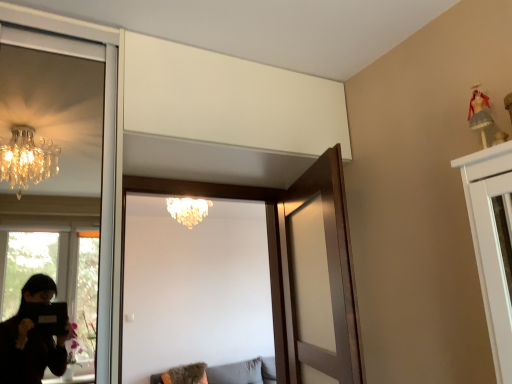
The height and width of the screenshot is (384, 512). I want to click on wooden door at center, placed as the 1th door when sorted from left to right, so click(x=275, y=219).

At what (x,y) coordinates should I click in order to perform the action: click on wooden door at center, which ranks as the 2th door in left-to-right order. Please return your answer as a coordinate pair (x, y). Looking at the image, I should click on (317, 276).

At what (x,y) coordinates should I click in order to perform the action: click on fluffy beige pillow at lower center. Please return your answer as a coordinate pair (x, y). The height and width of the screenshot is (384, 512). Looking at the image, I should click on (186, 374).

Can you tell me how much wooden door at center, acting as the 1th door starting from the right, and crystal chandelier at upper center differ in facing direction?

There is a 108-degree angle between the facing directions of wooden door at center, acting as the 1th door starting from the right, and crystal chandelier at upper center.

Which object is positioned more to the right, wooden door at center, which ranks as the 2th door in left-to-right order, or crystal chandelier at upper center?

From the viewer's perspective, wooden door at center, which ranks as the 2th door in left-to-right order, appears more on the right side.

Considering the relative sizes of wooden door at center, acting as the 1th door starting from the right, and crystal chandelier at upper center in the image provided, is wooden door at center, acting as the 1th door starting from the right, bigger than crystal chandelier at upper center?

No, wooden door at center, acting as the 1th door starting from the right, is not bigger than crystal chandelier at upper center.

From the image's perspective, does wooden door at center, acting as the 1th door starting from the right, appear higher than crystal chandelier at upper center?

No, from the image's perspective, wooden door at center, acting as the 1th door starting from the right, is not over crystal chandelier at upper center.

Does wooden door at center, acting as the 2th door starting from the right, have a lesser width compared to wooden door at center, which ranks as the 2th door in left-to-right order?

Incorrect, the width of wooden door at center, acting as the 2th door starting from the right, is not less than that of wooden door at center, which ranks as the 2th door in left-to-right order.

Considering the relative sizes of wooden door at center, acting as the 2th door starting from the right, and wooden door at center, which ranks as the 2th door in left-to-right order, in the image provided, is wooden door at center, acting as the 2th door starting from the right, smaller than wooden door at center, which ranks as the 2th door in left-to-right order,?

No.

Is wooden door at center, acting as the 2th door starting from the right, positioned before wooden door at center, acting as the 1th door starting from the right?

No, it is behind wooden door at center, acting as the 1th door starting from the right.

The height and width of the screenshot is (384, 512). In the image, there is a wooden door at center, acting as the 2th door starting from the right. Identify the location of door below it (from a real-world perspective). (317, 276).

Is gray fabric couch at lower center in front of or behind fluffy beige pillow at lower center in the image?

gray fabric couch at lower center is in front of fluffy beige pillow at lower center.

Between gray fabric couch at lower center and fluffy beige pillow at lower center, which one appears on the left side from the viewer's perspective?

fluffy beige pillow at lower center is more to the left.

In terms of size, does gray fabric couch at lower center appear bigger or smaller than fluffy beige pillow at lower center?

Considering their sizes, gray fabric couch at lower center takes up more space than fluffy beige pillow at lower center.

From a real-world perspective, which object stands above the other?

crystal chandelier at upper center, from a real-world perspective.

From the image's perspective, is fluffy beige pillow at lower center beneath crystal chandelier at upper center?

Yes, from the image's perspective, fluffy beige pillow at lower center is below crystal chandelier at upper center.

Is fluffy beige pillow at lower center oriented towards crystal chandelier at upper center?

No.

Which object is positioned more to the right, crystal chandelier at upper center or wooden door at center, placed as the 1th door when sorted from left to right?

wooden door at center, placed as the 1th door when sorted from left to right.

Between crystal chandelier at upper center and wooden door at center, placed as the 1th door when sorted from left to right, which one has smaller size?

crystal chandelier at upper center.

Between crystal chandelier at upper center and wooden door at center, placed as the 1th door when sorted from left to right, which one has larger width?

crystal chandelier at upper center.

Find the location of a particular element. Image resolution: width=512 pixels, height=384 pixels. door that is the 1st one below the crystal chandelier at upper center (from a real-world perspective) is located at coordinates (275, 219).

In order to click on the 1st door to the right of the gray fabric couch at lower center, counting from the anchor's position in this screenshot , I will do `click(275, 219)`.

Are wooden door at center, acting as the 2th door starting from the right, and gray fabric couch at lower center located far from each other?

Indeed, wooden door at center, acting as the 2th door starting from the right, is not near gray fabric couch at lower center.

Which is behind, point (325, 165) or point (260, 370)?

Point (260, 370)

Could you tell me if wooden door at center, placed as the 1th door when sorted from left to right, is facing crystal chandelier at upper center?

No, wooden door at center, placed as the 1th door when sorted from left to right, is not facing towards crystal chandelier at upper center.

Considering their positions, is wooden door at center, placed as the 1th door when sorted from left to right, located in front of or behind crystal chandelier at upper center?

wooden door at center, placed as the 1th door when sorted from left to right, is in front of crystal chandelier at upper center.

Considering the relative positions of wooden door at center, acting as the 2th door starting from the right, and crystal chandelier at upper center in the image provided, is wooden door at center, acting as the 2th door starting from the right, to the left or to the right of crystal chandelier at upper center?

In the image, wooden door at center, acting as the 2th door starting from the right, appears on the right side of crystal chandelier at upper center.

At what (x,y) coordinates should I click in order to perform the action: click on the 2nd door to the right of the crystal chandelier at upper center, starting your count from the anchor. Please return your answer as a coordinate pair (x, y). The height and width of the screenshot is (384, 512). Looking at the image, I should click on (317, 276).

This screenshot has height=384, width=512. What are the coordinates of `door above the wooden door at center, acting as the 2th door starting from the right (from the image's perspective)` in the screenshot? It's located at (317, 276).

Estimate the real-world distances between objects in this image. Which object is closer to gray fabric couch at lower center, wooden door at center, which ranks as the 2th door in left-to-right order, or crystal chandelier at upper center?

crystal chandelier at upper center lies closer to gray fabric couch at lower center than the other object.

Considering their positions, is crystal chandelier at upper center positioned closer to wooden door at center, placed as the 1th door when sorted from left to right, than gray fabric couch at lower center?

crystal chandelier at upper center is positioned closer to the anchor wooden door at center, placed as the 1th door when sorted from left to right.

From the image, which object appears to be farther from wooden door at center, acting as the 1th door starting from the right, fluffy beige pillow at lower center or wooden door at center, placed as the 1th door when sorted from left to right?

fluffy beige pillow at lower center is positioned further to the anchor wooden door at center, acting as the 1th door starting from the right.

Looking at the image, which one is located further to fluffy beige pillow at lower center, wooden door at center, which ranks as the 2th door in left-to-right order, or wooden door at center, placed as the 1th door when sorted from left to right?

wooden door at center, which ranks as the 2th door in left-to-right order, lies further to fluffy beige pillow at lower center than the other object.

Estimate the real-world distances between objects in this image. Which object is closer to fluffy beige pillow at lower center, crystal chandelier at upper center or wooden door at center, placed as the 1th door when sorted from left to right?

Based on the image, crystal chandelier at upper center appears to be nearer to fluffy beige pillow at lower center.

Which object lies nearer to the anchor point crystal chandelier at upper center, wooden door at center, which ranks as the 2th door in left-to-right order, or wooden door at center, placed as the 1th door when sorted from left to right?

Based on the image, wooden door at center, placed as the 1th door when sorted from left to right, appears to be nearer to crystal chandelier at upper center.

Looking at the image, which one is located closer to wooden door at center, acting as the 1th door starting from the right, wooden door at center, acting as the 2th door starting from the right, or crystal chandelier at upper center?

Among the two, wooden door at center, acting as the 2th door starting from the right, is located nearer to wooden door at center, acting as the 1th door starting from the right.

When comparing their distances from wooden door at center, which ranks as the 2th door in left-to-right order, does wooden door at center, acting as the 2th door starting from the right, or gray fabric couch at lower center seem further?

Based on the image, gray fabric couch at lower center appears to be further to wooden door at center, which ranks as the 2th door in left-to-right order.

The image size is (512, 384). I want to click on lamp between wooden door at center, acting as the 2th door starting from the right, and fluffy beige pillow at lower center from front to back, so click(x=188, y=210).

Where is `furniture between wooden door at center, acting as the 1th door starting from the right, and fluffy beige pillow at lower center from front to back`? furniture between wooden door at center, acting as the 1th door starting from the right, and fluffy beige pillow at lower center from front to back is located at coordinates (244, 372).

Identify the location of furniture located between wooden door at center, placed as the 1th door when sorted from left to right, and fluffy beige pillow at lower center in the depth direction. (244, 372).

Find the location of a particular element. This screenshot has height=384, width=512. lamp between wooden door at center, acting as the 1th door starting from the right, and fluffy beige pillow at lower center, along the z-axis is located at coordinates (188, 210).